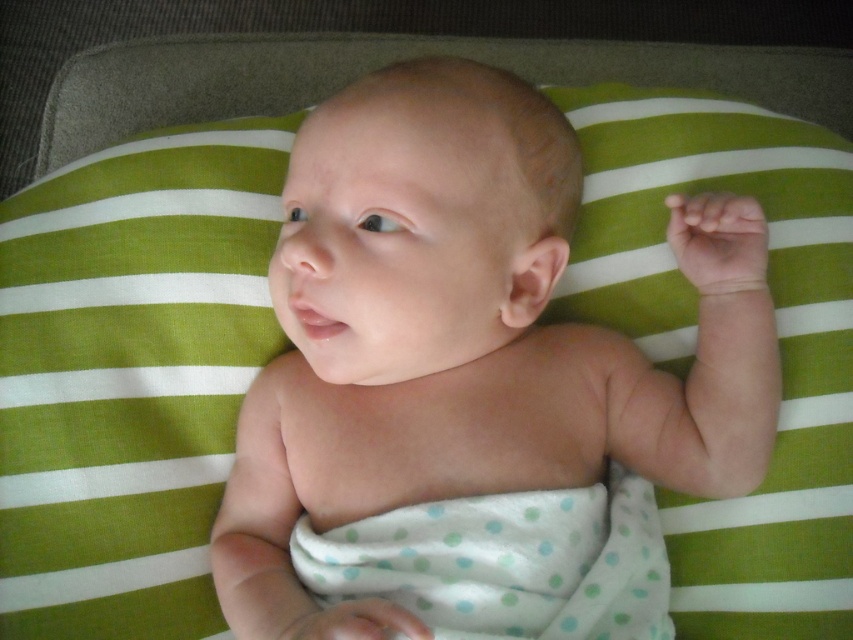
Question: From the image, what is the correct spatial relationship of smooth skin baby at center in relation to white polka dot fabric at center?

Choices:
 (A) left
 (B) right

Answer: (A)

Question: Can you confirm if smooth skin baby at center is positioned to the left of white polka dot fabric at center?

Choices:
 (A) yes
 (B) no

Answer: (A)

Question: Does smooth skin baby at center come behind white polka dot fabric at center?

Choices:
 (A) yes
 (B) no

Answer: (B)